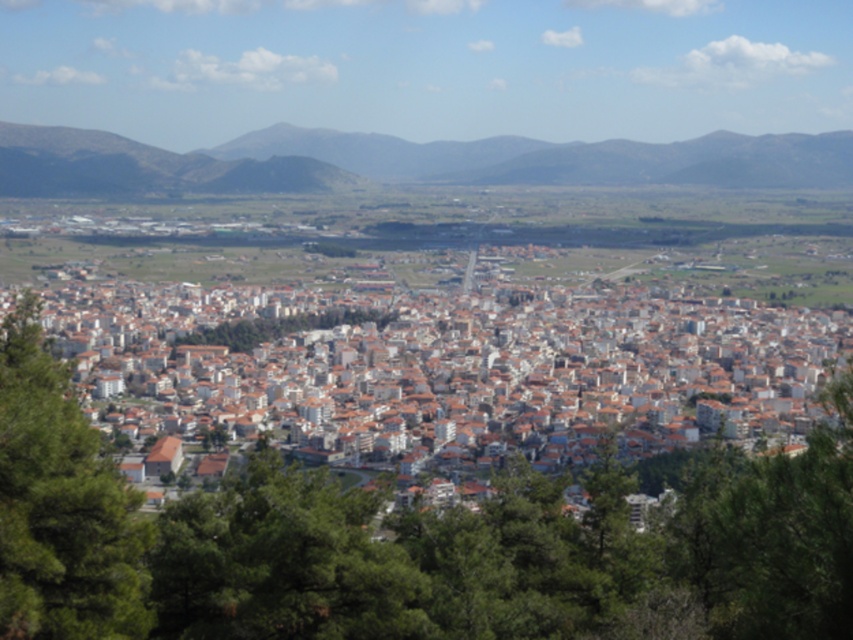
Question: Does white matte building at center appear over dark brown rocky hillside at upper center?

Choices:
 (A) no
 (B) yes

Answer: (A)

Question: Which point is closer to the camera?

Choices:
 (A) green leafy tree at lower left
 (B) green leafy tree at center
 (C) dark brown rocky hillside at upper center

Answer: (A)

Question: Is dark brown rocky hillside at upper center positioned behind green leafy tree at lower left?

Choices:
 (A) no
 (B) yes

Answer: (B)

Question: Is white matte building at center above green leafy tree at center?

Choices:
 (A) yes
 (B) no

Answer: (B)

Question: Which point appears closest to the camera in this image?

Choices:
 (A) (102, 141)
 (B) (248, 337)

Answer: (B)

Question: Which of the following is the farthest from the observer?

Choices:
 (A) green leafy tree at center
 (B) white matte building at center
 (C) dark brown rocky hillside at upper center
 (D) green leafy tree at lower right

Answer: (C)